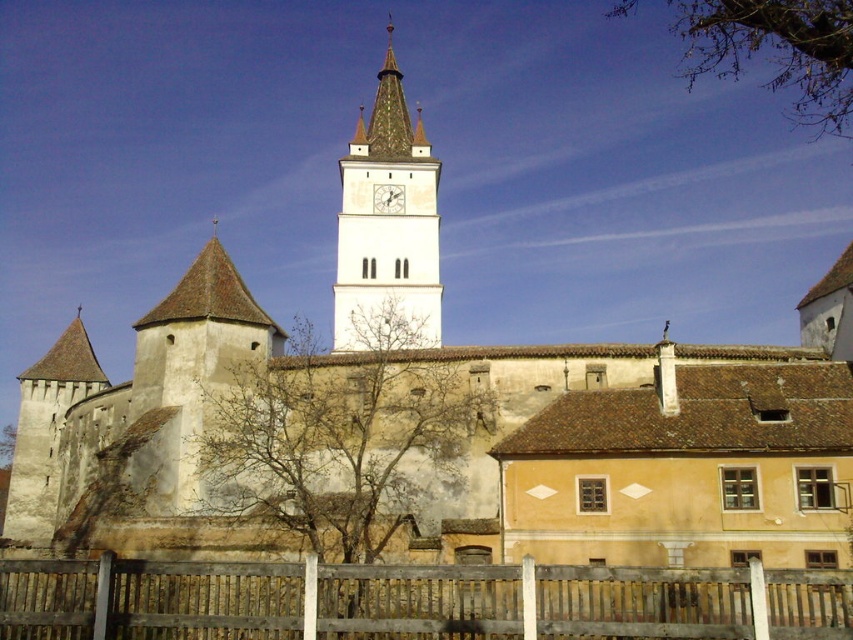
Question: Is brown wooden fence at lower center smaller than brown leafy tree at upper right?

Choices:
 (A) yes
 (B) no

Answer: (A)

Question: Which of these objects is positioned closest to the brown leafy tree at upper right?

Choices:
 (A) white stone clock tower at center
 (B) white wooden clock at center
 (C) brown wooden fence at lower center
 (D) bare branches at center

Answer: (A)

Question: Which of the following is the closest to the observer?

Choices:
 (A) (780, 13)
 (B) (363, 202)

Answer: (A)

Question: Which object is the farthest from the white stone clock tower at center?

Choices:
 (A) brown leafy tree at upper right
 (B) bare branches at center
 (C) brown wooden fence at lower center

Answer: (C)

Question: Does bare branches at center appear on the left side of white stone clock tower at center?

Choices:
 (A) no
 (B) yes

Answer: (B)

Question: Is the position of white stone clock tower at center more distant than that of brown leafy tree at upper right?

Choices:
 (A) no
 (B) yes

Answer: (B)